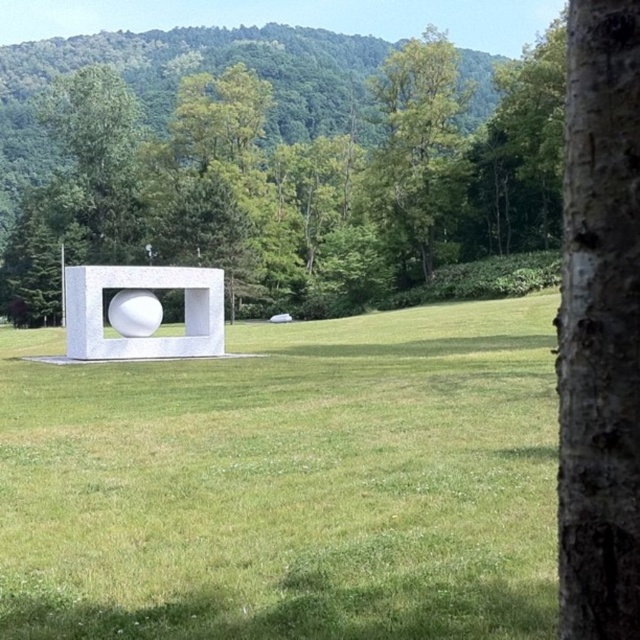
Between green grass at center and green leafy tree at upper center, which one is positioned lower?

green grass at center

Based on the photo, which is more to the right, green grass at center or green leafy tree at upper center?

Positioned to the right is green leafy tree at upper center.

Find the location of a particular element. The height and width of the screenshot is (640, 640). green grass at center is located at coordinates (288, 483).

The width and height of the screenshot is (640, 640). Find the location of `green grass at center`. green grass at center is located at coordinates (288, 483).

Between green grass at center and smooth bark tree at center, which one appears on the right side from the viewer's perspective?

smooth bark tree at center is more to the right.

Does green grass at center appear under smooth bark tree at center?

Yes, green grass at center is below smooth bark tree at center.

Is point (164, 570) positioned after point (301, 282)?

No, (164, 570) is closer to viewer.

At what (x,y) coordinates should I click in order to perform the action: click on green grass at center. Please return your answer as a coordinate pair (x, y). The width and height of the screenshot is (640, 640). Looking at the image, I should click on (288, 483).

Is smooth bark tree at center closer to camera compared to bark textured tree trunk at right?

No, smooth bark tree at center is behind bark textured tree trunk at right.

Who is taller, smooth bark tree at center or bark textured tree trunk at right?

smooth bark tree at center is taller.

Image resolution: width=640 pixels, height=640 pixels. Describe the element at coordinates (300, 186) in the screenshot. I see `smooth bark tree at center` at that location.

Where is `smooth bark tree at center`? Image resolution: width=640 pixels, height=640 pixels. smooth bark tree at center is located at coordinates (300, 186).